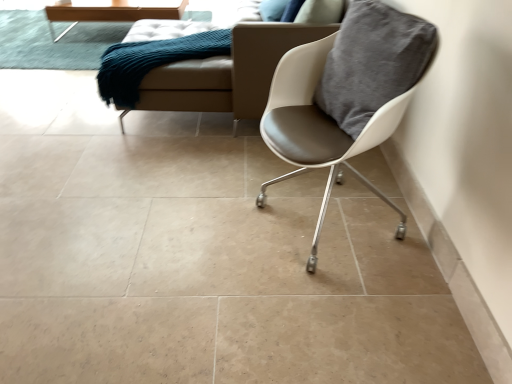
Question: Would you say teal fabric couch at upper left is to the left or to the right of wooden table at upper left in the picture?

Choices:
 (A) left
 (B) right

Answer: (B)

Question: Considering their positions, is teal fabric couch at upper left located in front of or behind wooden table at upper left?

Choices:
 (A) front
 (B) behind

Answer: (A)

Question: Estimate the real-world distances between objects in this image. Which object is farther from the white leather chair at right?

Choices:
 (A) teal knitted mat at upper left
 (B) teal fabric couch at upper left
 (C) wooden table at upper left
 (D) beige leather couch at upper center

Answer: (A)

Question: Considering the real-world distances, which object is farthest from the teal knitted mat at upper left?

Choices:
 (A) white leather chair at right
 (B) teal fabric couch at upper left
 (C) beige leather couch at upper center
 (D) wooden table at upper left

Answer: (A)